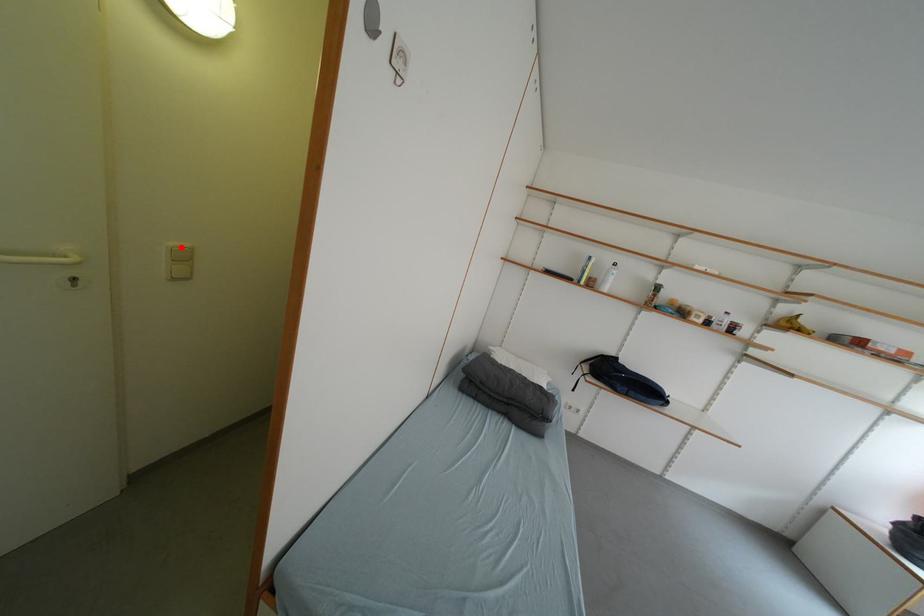
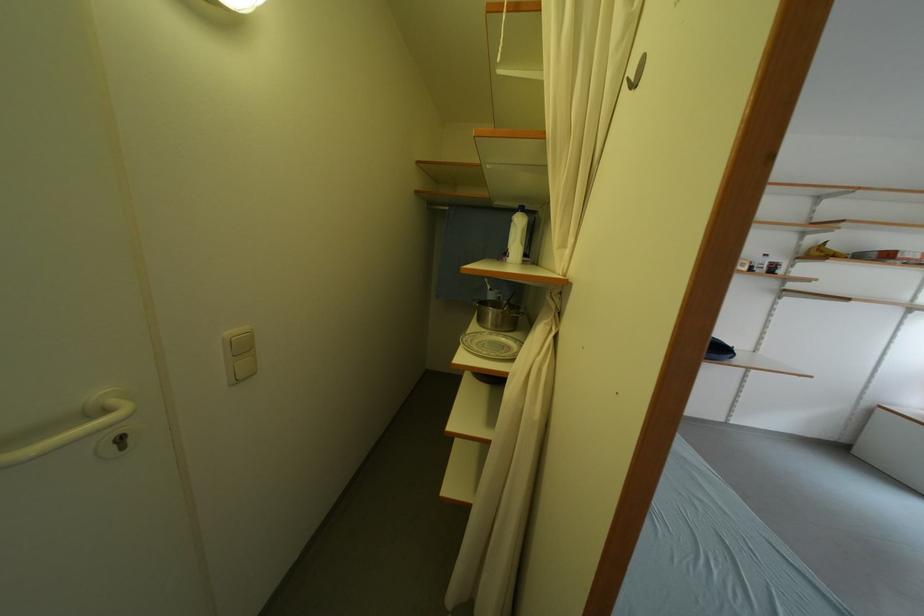
In the second image, find the point that corresponds to the highlighted location in the first image.

(237, 336)